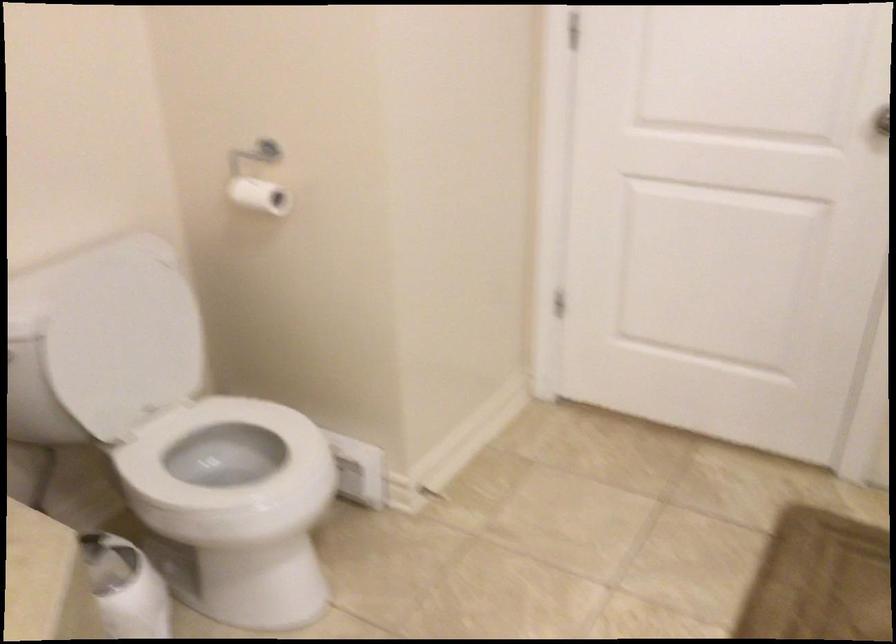
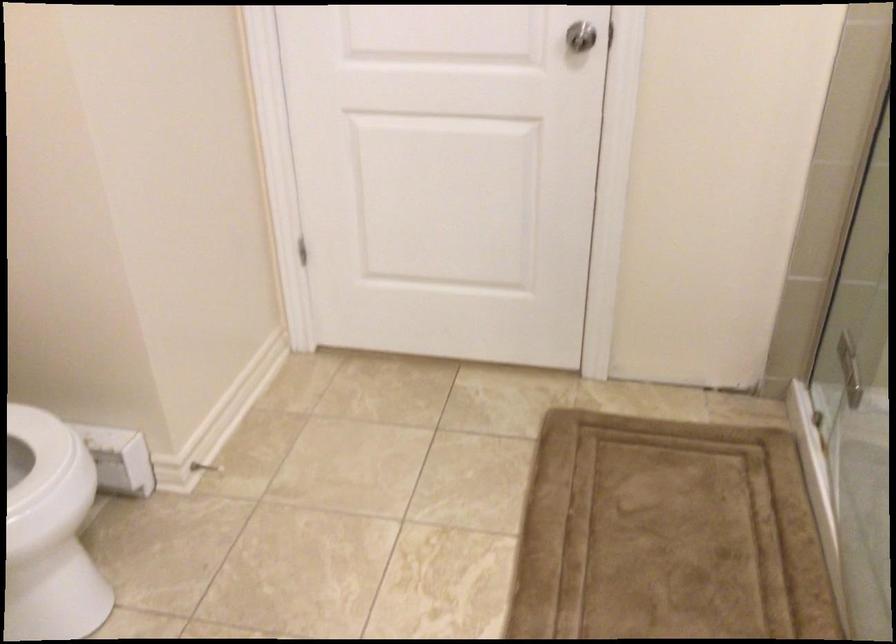
The images are taken continuously from a first-person perspective. In which direction are you moving?

The cameraman walked toward right, forward.